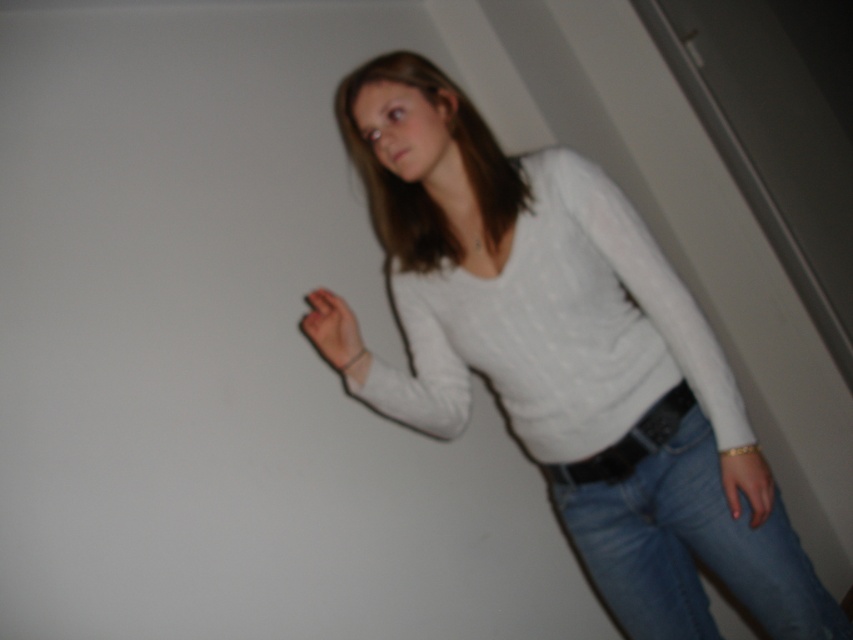
Question: Which object is the closest to the smooth skin hand at center?

Choices:
 (A) matte gold bracelet at lower right
 (B) black leather belt at center
 (C) blue denim jeans at lower right
 (D) white knitted sweater at center

Answer: (D)

Question: Can you confirm if blue denim jeans at lower right is positioned above smooth skin hand at center?

Choices:
 (A) yes
 (B) no

Answer: (B)

Question: Observing the image, what is the correct spatial positioning of black leather belt at center in reference to matte gold bracelet at lower right?

Choices:
 (A) above
 (B) below

Answer: (A)

Question: Which point is farther from the camera taking this photo?

Choices:
 (A) pos(587,164)
 (B) pos(677,404)

Answer: (B)

Question: Can you confirm if black leather belt at center is positioned to the left of smooth skin hand at center?

Choices:
 (A) no
 (B) yes

Answer: (A)

Question: Considering the real-world distances, which object is closest to the blue denim jeans at lower right?

Choices:
 (A) black leather belt at center
 (B) matte gold bracelet at lower right

Answer: (A)